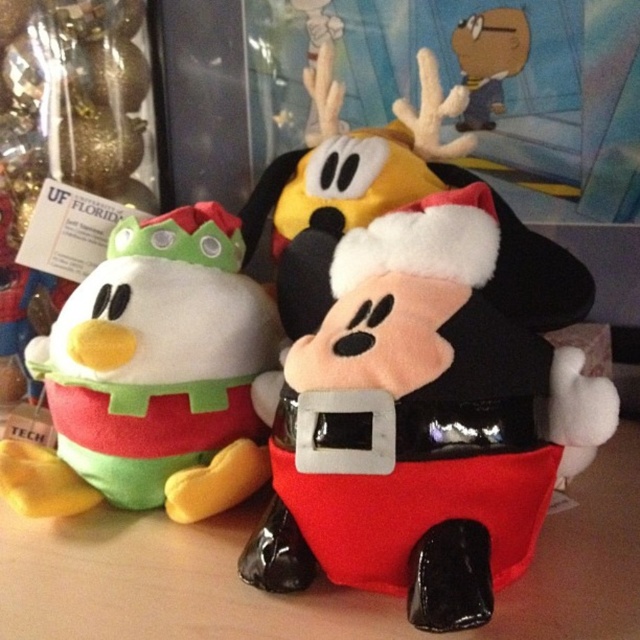
Question: Which point appears farthest from the camera in this image?

Choices:
 (A) (456, 33)
 (B) (227, 500)
 (C) (435, 392)

Answer: (A)

Question: Which object appears farthest from the camera in this image?

Choices:
 (A) velvety green plush duckling at left
 (B) smooth brown hat at upper center
 (C) velvet santa mickey at center

Answer: (B)

Question: Based on their relative distances, which object is farther from the velvet santa mickey at center?

Choices:
 (A) smooth brown hat at upper center
 (B) velvety green plush duckling at left

Answer: (A)

Question: Does velvet santa mickey at center appear on the right side of velvety green plush duckling at left?

Choices:
 (A) no
 (B) yes

Answer: (B)

Question: Is velvety green plush duckling at left to the right of smooth brown hat at upper center from the viewer's perspective?

Choices:
 (A) no
 (B) yes

Answer: (A)

Question: Where is velvet santa mickey at center located in relation to velvety green plush duckling at left in the image?

Choices:
 (A) above
 (B) below

Answer: (B)